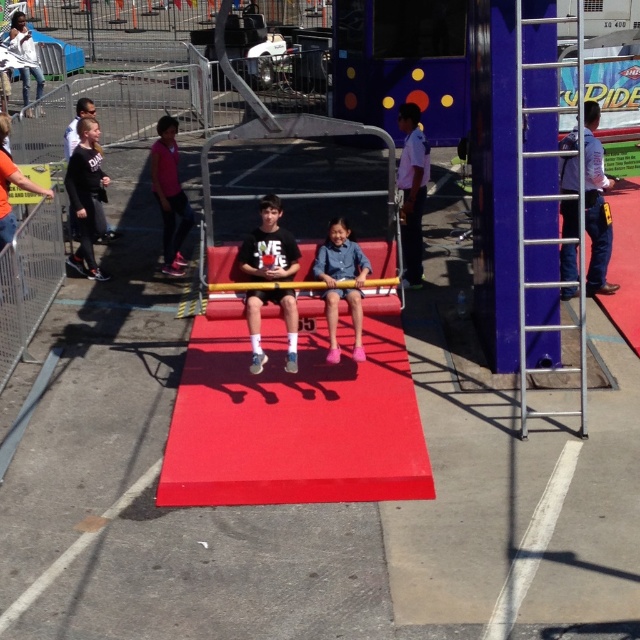
In the scene shown: Between matte black t-shirt at center and black cotton shirt at left, which one has less height?

matte black t-shirt at center

Where is `matte black t-shirt at center`? matte black t-shirt at center is located at coordinates (269, 244).

Between point (83, 164) and point (339, 289), which one is positioned in front?

Point (339, 289) is in front.

Who is more distant from viewer, (84,140) or (333,259)?

Point (84,140)

Is point (93, 132) closer to viewer compared to point (333, 307)?

No, (93, 132) is further to viewer.

Find the location of a particular element. Image resolution: width=640 pixels, height=640 pixels. black cotton shirt at left is located at coordinates (84, 195).

Does blue jeans at right have a greater width compared to white shirt at center?

Yes.

Does blue jeans at right appear on the right side of white shirt at center?

Yes, blue jeans at right is to the right of white shirt at center.

Identify the location of blue jeans at right. The width and height of the screenshot is (640, 640). click(x=596, y=204).

At what (x,y) coordinates should I click in order to perform the action: click on blue jeans at right. Please return your answer as a coordinate pair (x, y). Looking at the image, I should click on (596, 204).